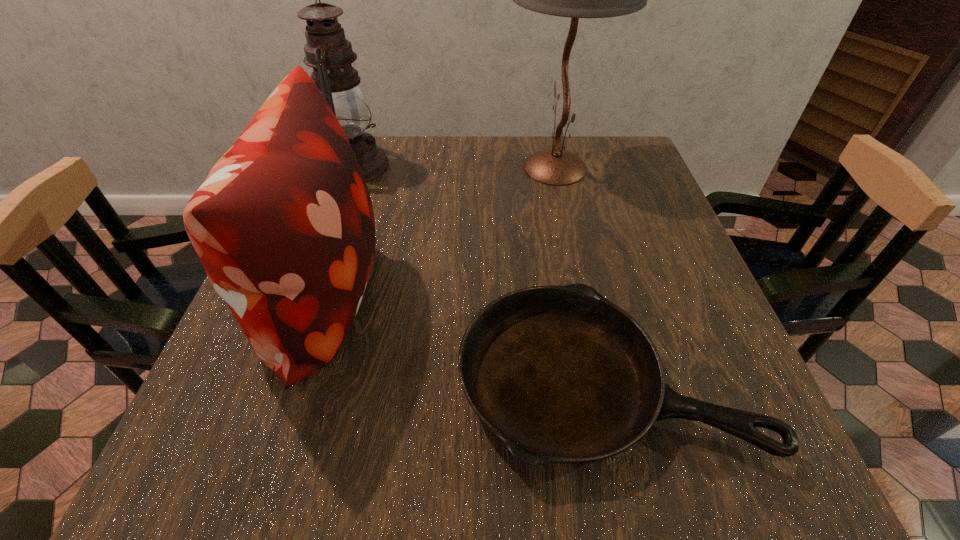
Image resolution: width=960 pixels, height=540 pixels. I want to click on table lamp, so click(558, 167).

I want to click on oil lamp, so click(328, 52).

The image size is (960, 540). What are the coordinates of `cushion` in the screenshot? It's located at (283, 224).

You are a GUI agent. You are given a task and a screenshot of the screen. Output one action in this format:
    pyautogui.click(x=<x>, y=<y>)
    Task: Click on the frying pan
    
    Given the screenshot: What is the action you would take?
    pyautogui.click(x=560, y=374)

I want to click on vacant space situated 0.290m on the front-facing side of the table lamp, so coord(395,168).

This screenshot has width=960, height=540. Identify the location of vacant space located 0.150m on the front-facing side of the table lamp. (447, 168).

Identify the location of free region located on the front-facing side of the table lamp. This screenshot has height=540, width=960. (425, 168).

Find the location of `blank area located 0.230m on the front of the oil lamp`. blank area located 0.230m on the front of the oil lamp is located at coordinates click(324, 252).

Identify the location of free space located on the front-facing side of the cushion. Image resolution: width=960 pixels, height=540 pixels. (508, 299).

Find the location of a particular element. This screenshot has height=540, width=960. vacant area situated on the left of the frying pan is located at coordinates (272, 380).